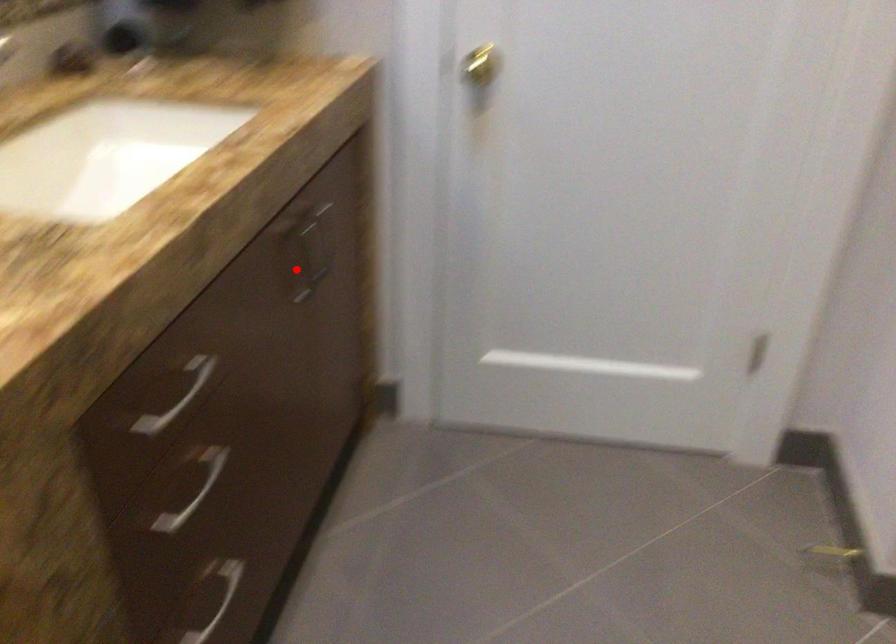
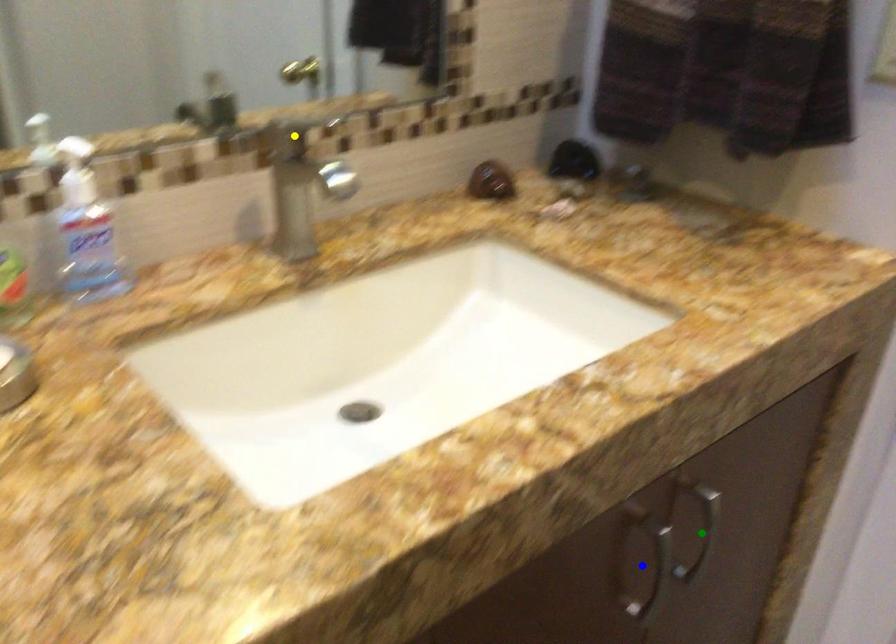
Question: I am providing you with two images of the same scene from different viewpoints. A red point is marked on the first image. You are given multiple points on the second image. Can you choose the point in image 2 that corresponds to the point in image 1?

Choices:
 (A) green point
 (B) blue point
 (C) yellow point

Answer: (B)